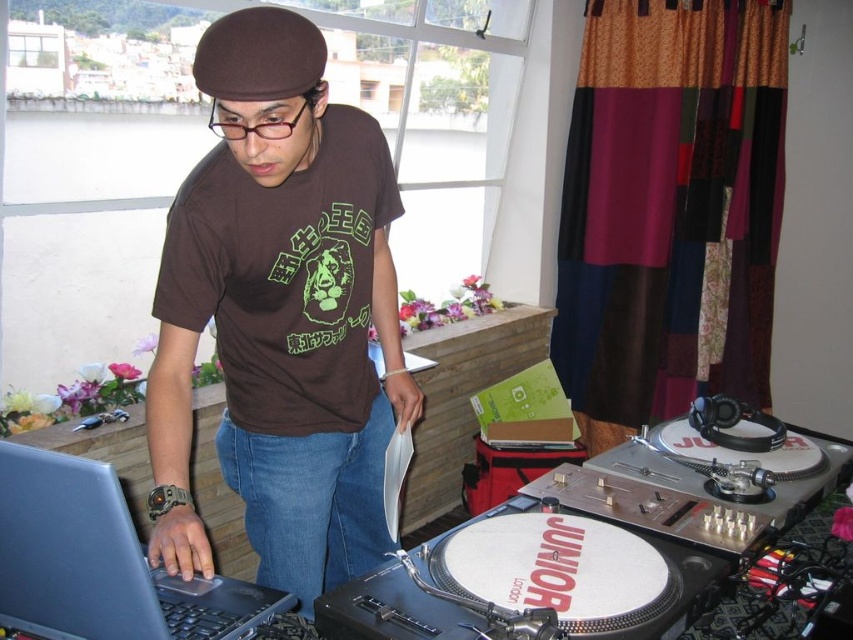
You are a DJ who wants to place a new speaker next to the white vinyl turntable at lower right. The speaker is 15 cm tall. Can the speaker fit vertically next to the turntable without exceeding the height of the matte black laptop at left?

The white vinyl turntable at lower right is not as tall as the matte black laptop at left, so the speaker that is 15 cm tall can be placed next to the turntable as long as its height does not exceed the laptop. However, since the turntable is shorter than the laptop, the speaker must be positioned in a way that its height stays within the laptop height limit.

You are a photographer taking a picture of the DJ setup. You need to decide which point to focus on first between point [318,323] and point [61,579]. Which point should you focus on first?

Point [318,323] is further to the viewer than point [61,579], so you should focus on point [318,323] first.